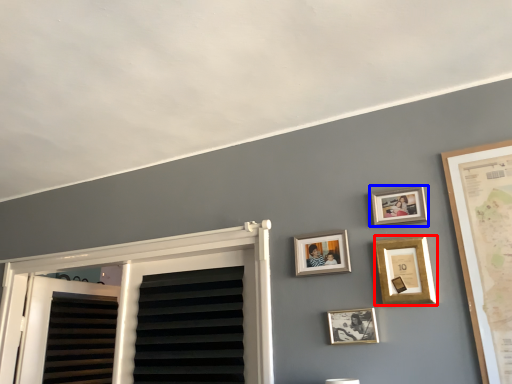
Question: Which point is further to the camera, picture frame (highlighted by a red box) or picture frame (highlighted by a blue box)?

Choices:
 (A) picture frame
 (B) picture frame

Answer: (B)